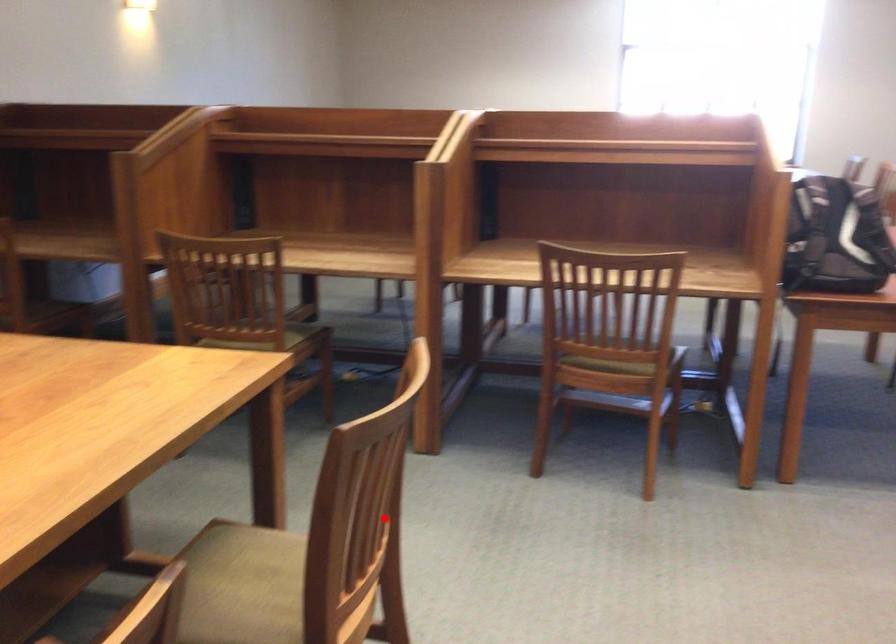
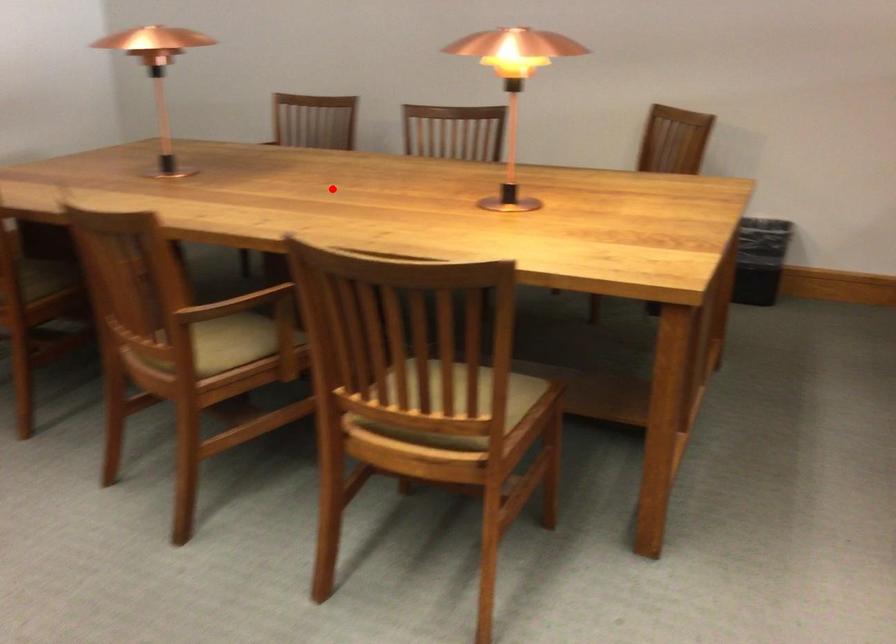
I am providing you with two images of the same scene from different viewpoints. A red point is marked on the first image and another point is marked on the second image. Do the highlighted points in image1 and image2 indicate the same real-world spot?

No